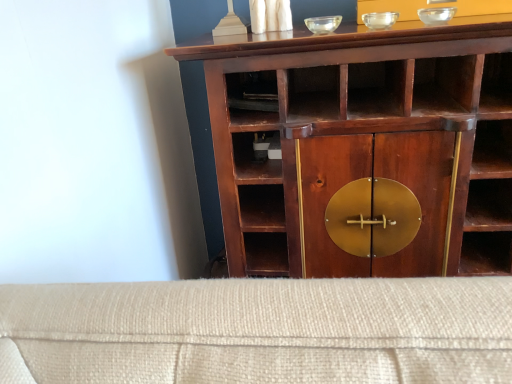
Question: Does mahogany wood cupboard at center lie in front of transparent glass bowl at upper right, the 1th glass bowl when ordered from right to left?

Choices:
 (A) no
 (B) yes

Answer: (B)

Question: Is mahogany wood cupboard at center shorter than transparent glass bowl at upper right, positioned as the 3th glass bowl in left-to-right order?

Choices:
 (A) no
 (B) yes

Answer: (A)

Question: Is mahogany wood cupboard at center oriented away from transparent glass bowl at upper right, positioned as the 3th glass bowl in left-to-right order?

Choices:
 (A) yes
 (B) no

Answer: (B)

Question: Considering the relative sizes of mahogany wood cupboard at center and transparent glass bowl at upper right, the 1th glass bowl when ordered from right to left, in the image provided, is mahogany wood cupboard at center thinner than transparent glass bowl at upper right, the 1th glass bowl when ordered from right to left,?

Choices:
 (A) yes
 (B) no

Answer: (B)

Question: From a real-world perspective, does mahogany wood cupboard at center sit lower than transparent glass bowl at upper right, the 1th glass bowl when ordered from right to left?

Choices:
 (A) yes
 (B) no

Answer: (A)

Question: From the image's perspective, does mahogany wood cupboard at center appear higher than transparent glass bowl at upper right, positioned as the 3th glass bowl in left-to-right order?

Choices:
 (A) yes
 (B) no

Answer: (B)

Question: Is transparent glass bowl at upper center, acting as the second glass bowl starting from the left, with transparent glass bowl at upper right, the 1th glass bowl when ordered from right to left?

Choices:
 (A) no
 (B) yes

Answer: (B)

Question: From the image's perspective, would you say transparent glass bowl at upper center, acting as the second glass bowl starting from the left, is shown under transparent glass bowl at upper right, the 1th glass bowl when ordered from right to left?

Choices:
 (A) yes
 (B) no

Answer: (A)

Question: Is transparent glass bowl at upper center, positioned as the 2th glass bowl in right-to-left order, at the right side of transparent glass bowl at upper right, the 1th glass bowl when ordered from right to left?

Choices:
 (A) yes
 (B) no

Answer: (B)

Question: Is transparent glass bowl at upper center, positioned as the 2th glass bowl in right-to-left order, bigger than transparent glass bowl at upper right, positioned as the 3th glass bowl in left-to-right order?

Choices:
 (A) no
 (B) yes

Answer: (B)

Question: Is transparent glass bowl at upper center, positioned as the 2th glass bowl in right-to-left order, smaller than transparent glass bowl at upper right, positioned as the 3th glass bowl in left-to-right order?

Choices:
 (A) no
 (B) yes

Answer: (A)

Question: From the image's perspective, would you say transparent glass bowl at upper center, acting as the second glass bowl starting from the left, is positioned over transparent glass bowl at upper right, the 1th glass bowl when ordered from right to left?

Choices:
 (A) no
 (B) yes

Answer: (A)

Question: Is transparent glass bowl at upper center, acting as the 3th glass bowl starting from the right, positioned with its back to transparent glass bowl at upper center, positioned as the 2th glass bowl in right-to-left order?

Choices:
 (A) no
 (B) yes

Answer: (A)